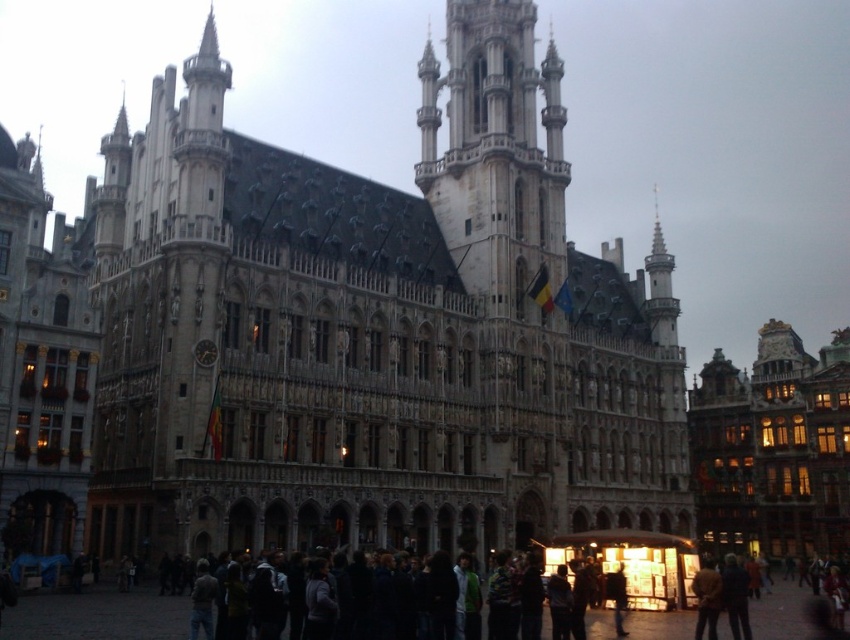
You are standing in front of the historic building and want to locate two specific points marked on its facade. The first point is at coordinate point(x=675, y=324) and the second at point(x=544, y=300). Which of these two points is closer to your current position?

Point(x=675, y=324) is closer to your current position because it is further to the viewer than point(x=544, y=300).

You are standing in a city square and want to take a photo of the stone building at center. If your camera can focus up to 50 meters, will you be able to capture a clear image?

The stone building at center is 56.42 meters away from the viewer. Since the camera can only focus up to 50 meters, it will not be able to capture a clear image.

You are standing in the city square facing the stone building at center and the stone tower at center. Which of these two structures is positioned more to the left from your perspective?

The stone building at center is positioned to the left of the stone tower at center, so it is more to the left.